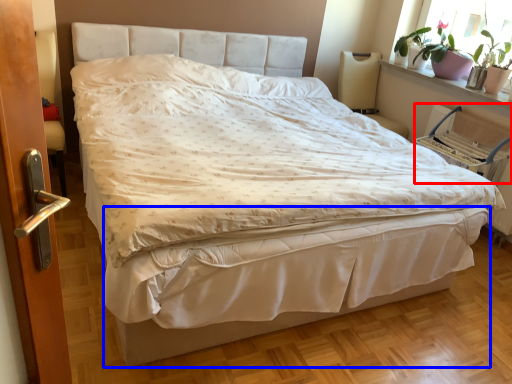
Question: Which object appears closest to the camera in this image, armchair (highlighted by a red box) or bed frame (highlighted by a blue box)?

Choices:
 (A) armchair
 (B) bed frame

Answer: (B)